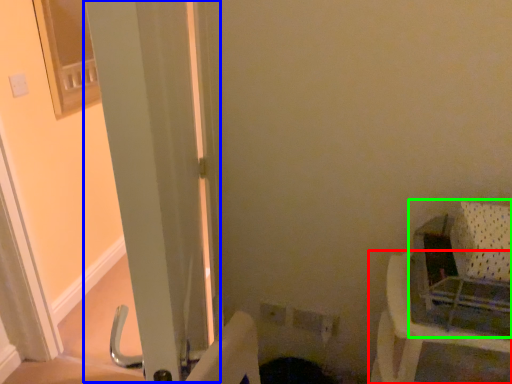
Question: Estimate the real-world distances between objects in this image. Which object is closer to furniture (highlighted by a red box), screen door (highlighted by a blue box) or baby carriage (highlighted by a green box)?

Choices:
 (A) screen door
 (B) baby carriage

Answer: (B)